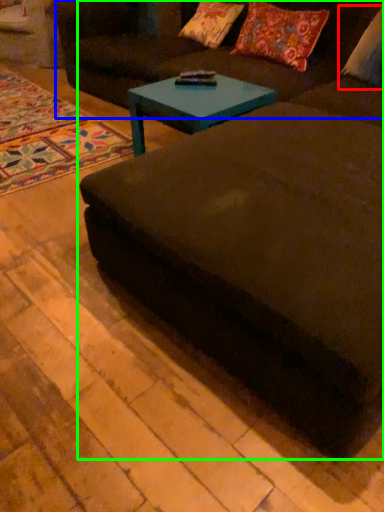
Question: Based on their relative distances, which object is farther from pillow (highlighted by a red box)? Choose from couch (highlighted by a blue box) and studio couch (highlighted by a green box).

Choices:
 (A) couch
 (B) studio couch

Answer: (B)